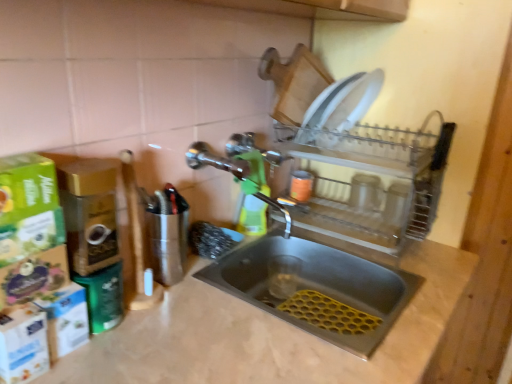
Question: Is the position of polished chrome tap at center more distant than that of beige marble counter top at center?

Choices:
 (A) yes
 (B) no

Answer: (A)

Question: Can you confirm if polished chrome tap at center is shorter than beige marble counter top at center?

Choices:
 (A) no
 (B) yes

Answer: (B)

Question: Is polished chrome tap at center to the right of beige marble counter top at center from the viewer's perspective?

Choices:
 (A) no
 (B) yes

Answer: (A)

Question: From a real-world perspective, is polished chrome tap at center positioned under beige marble counter top at center based on gravity?

Choices:
 (A) yes
 (B) no

Answer: (B)

Question: Is polished chrome tap at center taller than beige marble counter top at center?

Choices:
 (A) no
 (B) yes

Answer: (A)

Question: From the image's perspective, is polished chrome tap at center beneath beige marble counter top at center?

Choices:
 (A) yes
 (B) no

Answer: (B)

Question: Is polished chrome tap at center at the right side of clear plastic dish rack at upper right?

Choices:
 (A) no
 (B) yes

Answer: (A)

Question: Is polished chrome tap at center oriented away from clear plastic dish rack at upper right?

Choices:
 (A) no
 (B) yes

Answer: (A)

Question: Can you confirm if polished chrome tap at center is thinner than clear plastic dish rack at upper right?

Choices:
 (A) yes
 (B) no

Answer: (A)

Question: From a real-world perspective, is polished chrome tap at center under clear plastic dish rack at upper right?

Choices:
 (A) yes
 (B) no

Answer: (B)

Question: From the image's perspective, is polished chrome tap at center beneath clear plastic dish rack at upper right?

Choices:
 (A) yes
 (B) no

Answer: (B)

Question: Is polished chrome tap at center outside of clear plastic dish rack at upper right?

Choices:
 (A) yes
 (B) no

Answer: (A)

Question: Can you confirm if beige marble counter top at center is smaller than polished chrome tap at center?

Choices:
 (A) no
 (B) yes

Answer: (A)